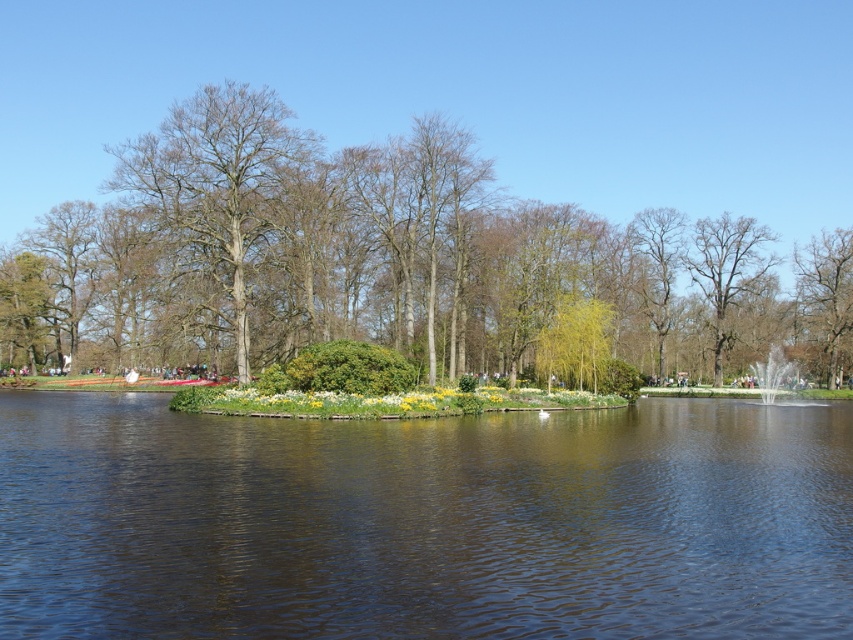
Question: Is smooth bark tree at center positioned in front of smooth bark tree at right?

Choices:
 (A) no
 (B) yes

Answer: (A)

Question: Can you confirm if bare wood tree at center is positioned to the right of smooth bark tree at center?

Choices:
 (A) yes
 (B) no

Answer: (B)

Question: Which object is positioned farthest from the smooth bark tree at center?

Choices:
 (A) green leafy tree at center
 (B) clear water at center

Answer: (B)

Question: Does green leafy tree at center have a lesser width compared to bare wood tree at center?

Choices:
 (A) yes
 (B) no

Answer: (B)

Question: Which point is closer to the camera?

Choices:
 (A) clear water at center
 (B) smooth bark tree at right

Answer: (A)

Question: Which point appears farthest from the camera in this image?

Choices:
 (A) (x=184, y=173)
 (B) (x=260, y=584)

Answer: (A)